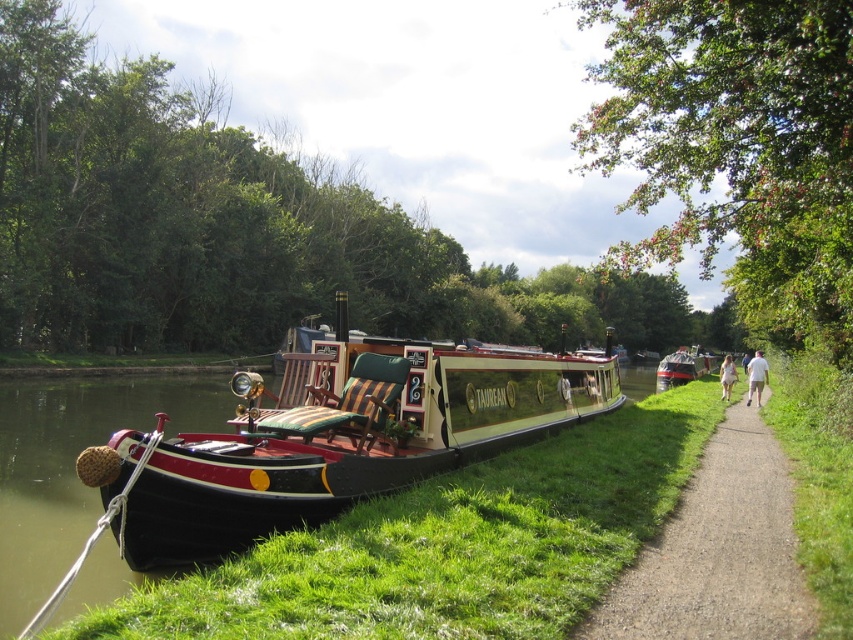
You are planning to walk from the gravel path at right to the polished wood boat at center. Considering their sizes, which one do you think will take up more space in the scene?

The polished wood boat at center is bigger than the gravel path at right, so it will take up more space in the scene.

You are a delivery person with a cart that is 2 meters wide. You need to move from the gravel path at right to the polished wood boat at center. Is there enough space between them for your cart to pass through?

The distance between the polished wood boat at center and the gravel path at right is 5.97 meters. Since your cart is only 2 meters wide, there is sufficient space for it to pass through comfortably.